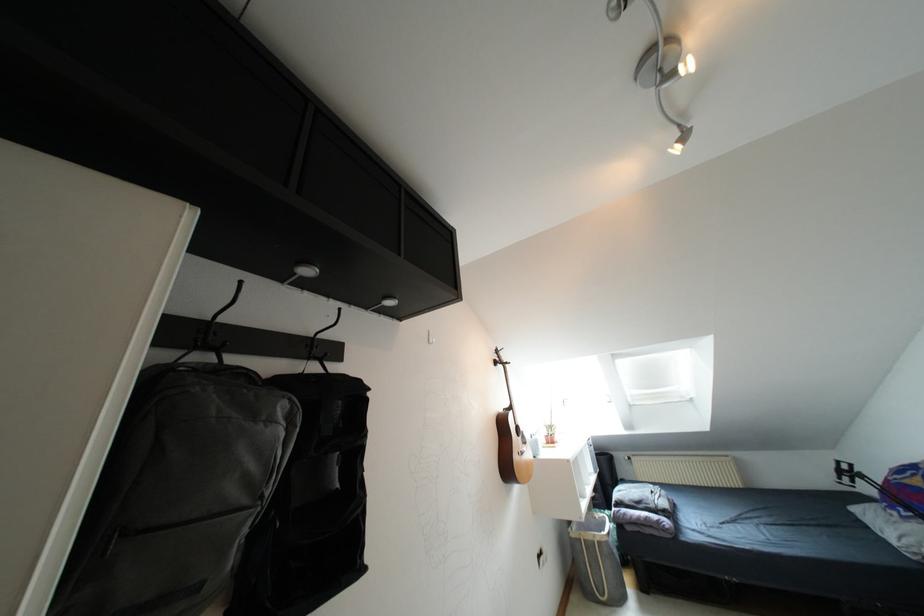
Describe the element at coordinates (236, 374) in the screenshot. I see `the backpack top handle` at that location.